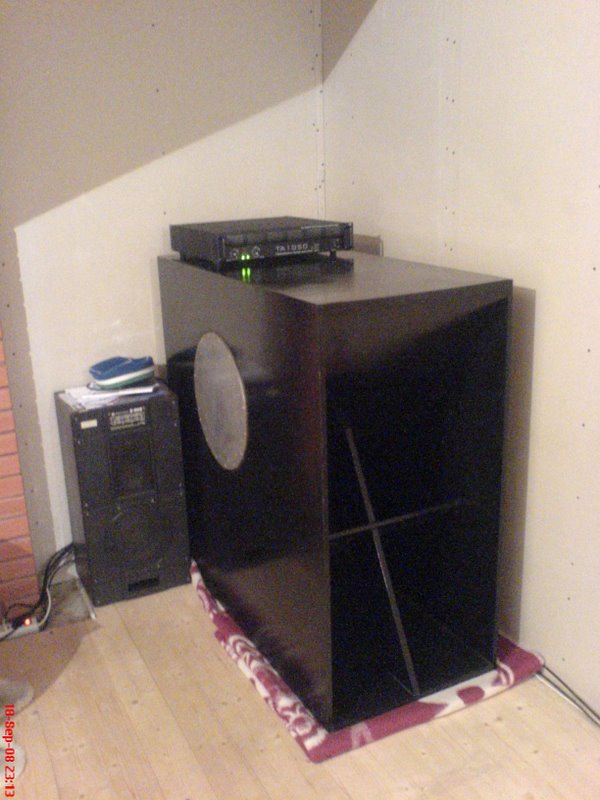
Where is `cabinet`? This screenshot has height=800, width=600. cabinet is located at coordinates (315, 444).